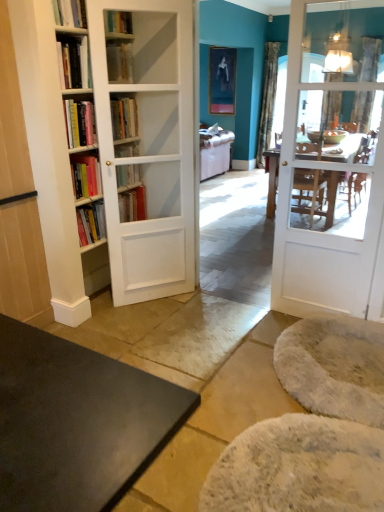
Question: Does matte black portrait at upper center have a greater height compared to white fluffy yoga mat at lower right, positioned as the 1th yoga mat in back-to-front order?

Choices:
 (A) yes
 (B) no

Answer: (A)

Question: From a real-world perspective, is matte black portrait at upper center positioned over white fluffy yoga mat at lower right, positioned as the 1th yoga mat in back-to-front order, based on gravity?

Choices:
 (A) yes
 (B) no

Answer: (A)

Question: Is matte black portrait at upper center not inside white fluffy yoga mat at lower right, positioned as the 1th yoga mat in back-to-front order?

Choices:
 (A) no
 (B) yes

Answer: (B)

Question: Considering the relative sizes of matte black portrait at upper center and white fluffy yoga mat at lower right, positioned as the 1th yoga mat in back-to-front order, in the image provided, is matte black portrait at upper center thinner than white fluffy yoga mat at lower right, positioned as the 1th yoga mat in back-to-front order,?

Choices:
 (A) no
 (B) yes

Answer: (B)

Question: Considering the relative sizes of matte black portrait at upper center and white fluffy yoga mat at lower right, positioned as the 1th yoga mat in back-to-front order, in the image provided, is matte black portrait at upper center wider than white fluffy yoga mat at lower right, positioned as the 1th yoga mat in back-to-front order,?

Choices:
 (A) yes
 (B) no

Answer: (B)

Question: Is white fluffy yoga mat at lower right, the second yoga mat positioned from the front, at the back of matte black portrait at upper center?

Choices:
 (A) no
 (B) yes

Answer: (A)

Question: Does white wooden door at right appear on the right side of matte black portrait at upper center?

Choices:
 (A) yes
 (B) no

Answer: (A)

Question: Is white wooden door at right facing towards matte black portrait at upper center?

Choices:
 (A) yes
 (B) no

Answer: (B)

Question: Does white wooden door at right come in front of matte black portrait at upper center?

Choices:
 (A) no
 (B) yes

Answer: (B)

Question: Is white wooden door at right completely or partially outside of matte black portrait at upper center?

Choices:
 (A) yes
 (B) no

Answer: (A)

Question: From a real-world perspective, is white wooden door at right on matte black portrait at upper center?

Choices:
 (A) yes
 (B) no

Answer: (B)

Question: Can you confirm if white wooden door at right is bigger than matte black portrait at upper center?

Choices:
 (A) yes
 (B) no

Answer: (A)

Question: Considering the relative sizes of metallic glass lampshade at upper right and matte black portrait at upper center in the image provided, is metallic glass lampshade at upper right wider than matte black portrait at upper center?

Choices:
 (A) yes
 (B) no

Answer: (A)